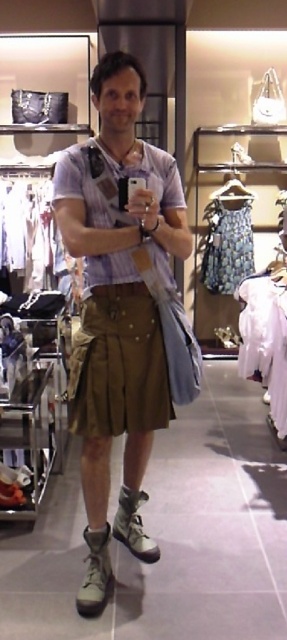
You are a fashion designer trying to create a new outfit. You see a brown pleated kilt at center and a printed fabric dress at center in the store. Which garment should you choose if you want something slimmer in the waist area?

The brown pleated kilt at center is thinner than the printed fabric dress at center, so you should choose the brown pleated kilt at center for a slimmer waist area.

You are a fashion designer observing a person wearing two garments in a store. The garments are the brown pleated kilt at center and the printed fabric dress at center. Which garment has a larger size?

The printed fabric dress at center is larger than the brown pleated kilt at center.

You are a photographer who needs to capture a detailed closeup of the brown cotton kilt at center. Given that your camera has a minimum focusing distance of 1.5 meters, will you be able to take the photo without moving closer?

The distance between the brown cotton kilt at center and the camera is 1.74 meters. Since the minimum focusing distance is 1.5 meters, the camera can focus at 1.74 meters, so yes, you can take the closeup without moving closer.